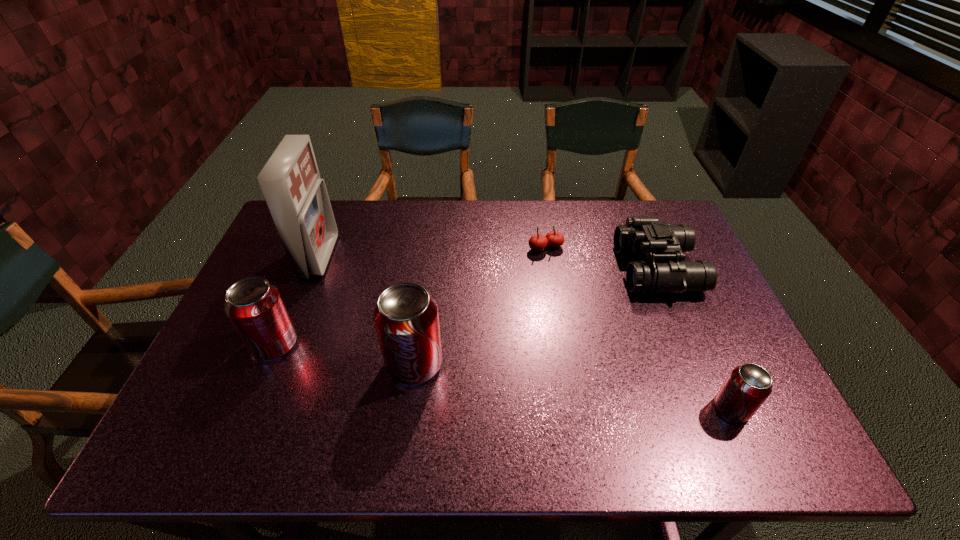
Where is `the third tallest object`? the third tallest object is located at coordinates (254, 306).

I want to click on the leftmost soda can, so click(x=254, y=306).

Find the location of a particular element. The image size is (960, 540). the fourth object from right to left is located at coordinates [x=406, y=319].

Locate an element on the screen. This screenshot has width=960, height=540. the shortest soda can is located at coordinates (747, 387).

You are a GUI agent. You are given a task and a screenshot of the screen. Output one action in this format:
    pyautogui.click(x=<x>, y=<y>)
    Task: Click on the rightmost soda can
    The width and height of the screenshot is (960, 540).
    Given the screenshot: What is the action you would take?
    pyautogui.click(x=747, y=387)

Locate an element on the screen. The image size is (960, 540). the first-aid kit is located at coordinates (297, 198).

Find the location of a particular element. Image resolution: width=960 pixels, height=540 pixels. the shortest object is located at coordinates point(538,242).

The image size is (960, 540). I want to click on cherry, so click(538, 242).

Locate an element on the screen. This screenshot has width=960, height=540. the fourth tallest object is located at coordinates (647, 236).

You are a GUI agent. You are given a task and a screenshot of the screen. Output one action in this format:
    pyautogui.click(x=<x>, y=<y>)
    Task: Click on the free region located 0.130m on the front of the second shortest soda can
    The height and width of the screenshot is (540, 960).
    Given the screenshot: What is the action you would take?
    pyautogui.click(x=246, y=412)